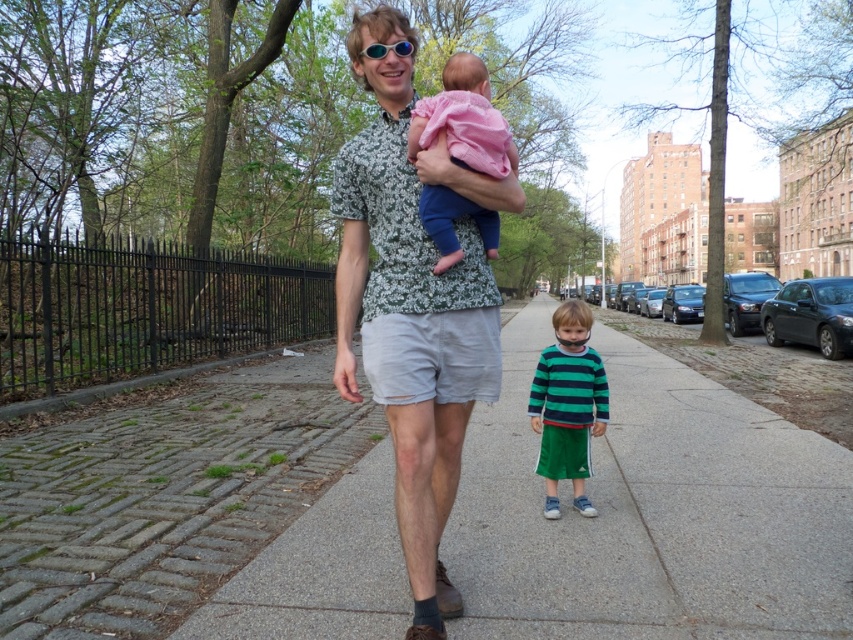
From the picture: You are standing at the point labeled point (x=511, y=202) in the image. The man with the baby is walking towards you. If the man walks at a speed of 3 feet per second, how many seconds will it take for him to reach you?

The distance between the point labeled point (x=511, y=202) and the viewer is 8.44 feet. Since the man is walking towards you at 3 feet per second, it will take him 8.44 divided by 3, which is approximately 2.81 seconds to reach you.